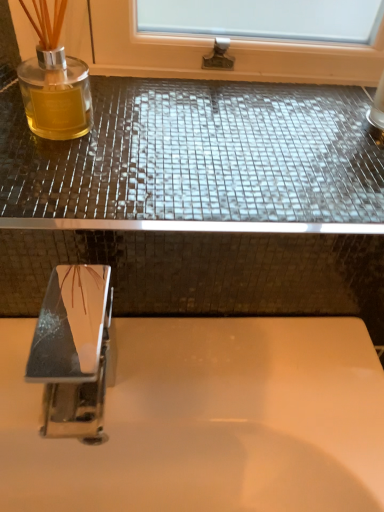
Question: Is polished chrome tap at lower left positioned before shiny mosaic tile counter top at upper center?

Choices:
 (A) no
 (B) yes

Answer: (B)

Question: From a real-world perspective, does polished chrome tap at lower left stand above shiny mosaic tile counter top at upper center?

Choices:
 (A) yes
 (B) no

Answer: (B)

Question: Does polished chrome tap at lower left lie behind shiny mosaic tile counter top at upper center?

Choices:
 (A) no
 (B) yes

Answer: (A)

Question: Could you tell me if polished chrome tap at lower left is turned towards shiny mosaic tile counter top at upper center?

Choices:
 (A) no
 (B) yes

Answer: (A)

Question: Considering the relative sizes of polished chrome tap at lower left and shiny mosaic tile counter top at upper center in the image provided, is polished chrome tap at lower left smaller than shiny mosaic tile counter top at upper center?

Choices:
 (A) yes
 (B) no

Answer: (A)

Question: From the image's perspective, is polished chrome tap at lower left located beneath shiny mosaic tile counter top at upper center?

Choices:
 (A) no
 (B) yes

Answer: (B)

Question: Are shiny mosaic tile counter top at upper center and polished chrome tap at lower left located far from each other?

Choices:
 (A) yes
 (B) no

Answer: (B)

Question: From a real-world perspective, is shiny mosaic tile counter top at upper center on top of polished chrome tap at lower left?

Choices:
 (A) no
 (B) yes

Answer: (B)

Question: Considering the relative positions of shiny mosaic tile counter top at upper center and polished chrome tap at lower left in the image provided, is shiny mosaic tile counter top at upper center to the right of polished chrome tap at lower left from the viewer's perspective?

Choices:
 (A) yes
 (B) no

Answer: (A)

Question: Can we say shiny mosaic tile counter top at upper center lies outside polished chrome tap at lower left?

Choices:
 (A) no
 (B) yes

Answer: (B)

Question: Can you confirm if shiny mosaic tile counter top at upper center is shorter than polished chrome tap at lower left?

Choices:
 (A) yes
 (B) no

Answer: (A)

Question: Can you confirm if shiny mosaic tile counter top at upper center is positioned to the left of polished chrome tap at lower left?

Choices:
 (A) no
 (B) yes

Answer: (A)

Question: Is white glossy sink at center smaller than shiny mosaic tile counter top at upper center?

Choices:
 (A) no
 (B) yes

Answer: (A)